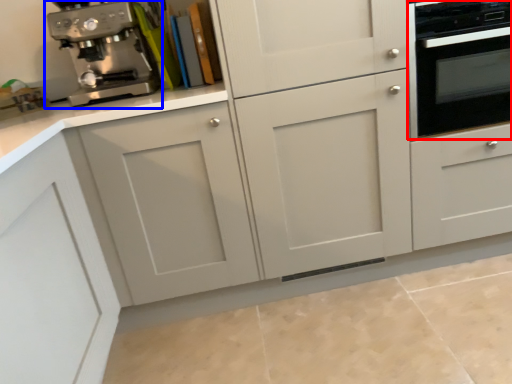
Question: Which point is closer to the camera, home appliance (highlighted by a red box) or coffee maker (highlighted by a blue box)?

Choices:
 (A) home appliance
 (B) coffee maker

Answer: (A)